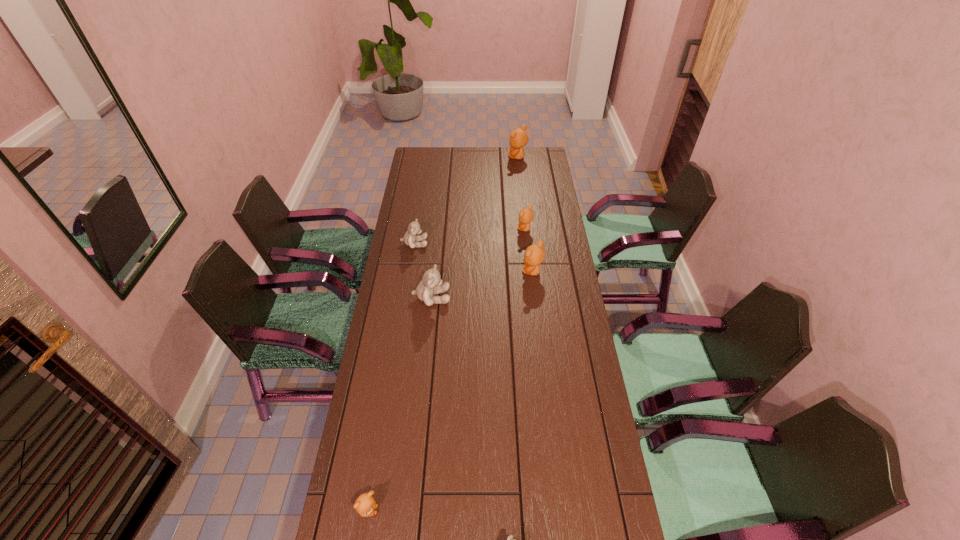
Find the location of a particular element. The width and height of the screenshot is (960, 540). the leftmost brown teddy bear is located at coordinates (365, 505).

The width and height of the screenshot is (960, 540). What are the coordinates of `the smallest brown teddy bear` in the screenshot? It's located at (365, 505).

Locate an element on the screen. The height and width of the screenshot is (540, 960). free space located 0.270m on the face of the farthest object is located at coordinates (459, 157).

This screenshot has width=960, height=540. Find the location of `free space located 0.220m on the face of the farthest object`. free space located 0.220m on the face of the farthest object is located at coordinates (468, 157).

The height and width of the screenshot is (540, 960). What are the coordinates of `free region located on the face of the farthest object` in the screenshot? It's located at (443, 157).

What are the coordinates of `vacant space positioned on the face of the fourth farthest object` in the screenshot? It's located at (464, 272).

Locate an element on the screen. Image resolution: width=960 pixels, height=540 pixels. free space located on the face of the fourth farthest object is located at coordinates (473, 272).

Identify the location of vacant region located 0.090m on the face of the fourth farthest object. Image resolution: width=960 pixels, height=540 pixels. (500, 272).

Identify the location of free space located 0.400m on the face of the second farthest gray teddy bear. Image resolution: width=960 pixels, height=540 pixels. (553, 297).

Locate an element on the screen. The image size is (960, 540). vacant space situated 0.290m on the face of the second farthest teddy bear is located at coordinates (453, 229).